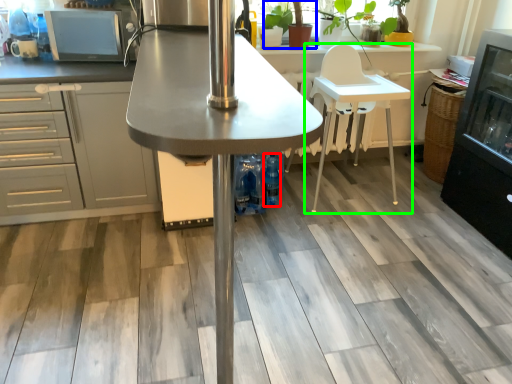
Question: Which object is the closest to the bottle (highlighted by a red box)? Choose among these: plant (highlighted by a blue box) or chair (highlighted by a green box).

Choices:
 (A) plant
 (B) chair

Answer: (B)